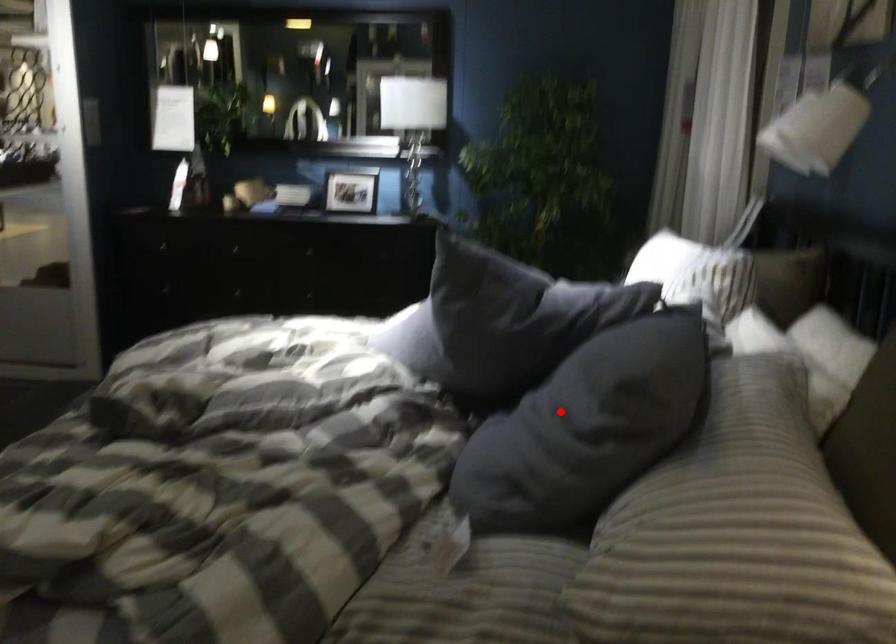
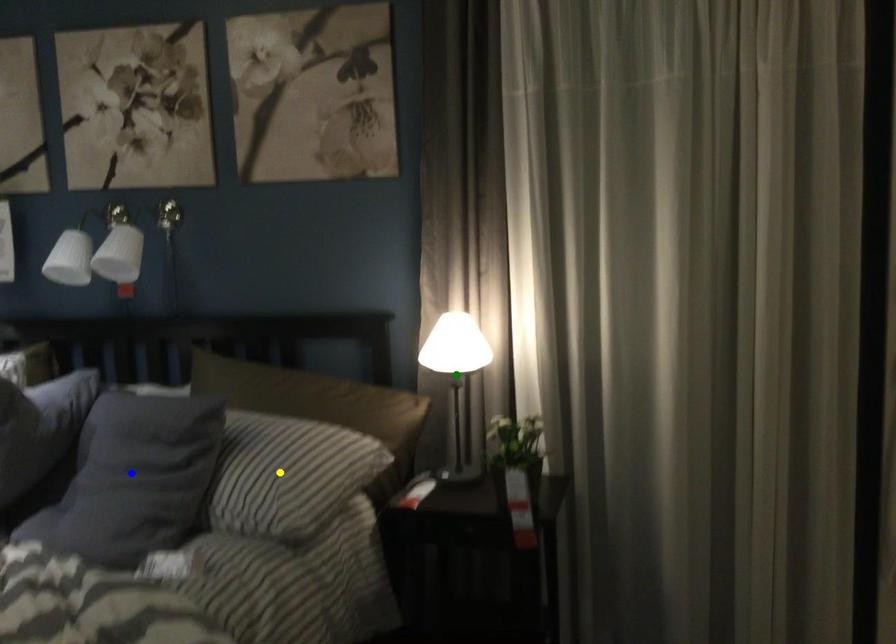
Question: I am providing you with two images of the same scene from different viewpoints. A red point is marked on the first image. You are given multiple points on the second image. In image 2, which mark is for the same physical point as the one in image 1?

Choices:
 (A) green point
 (B) blue point
 (C) yellow point

Answer: (B)